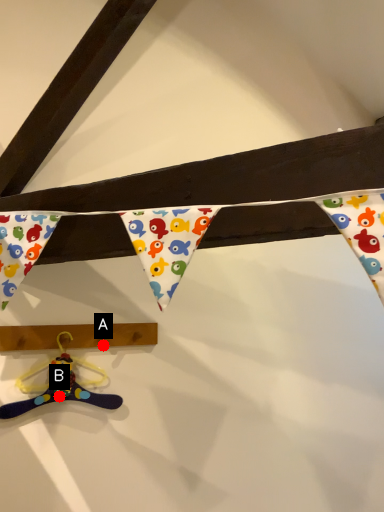
Question: Two points are circled on the image, labeled by A and B beside each circle. Which point is further to the camera?

Choices:
 (A) A is further
 (B) B is further

Answer: (A)